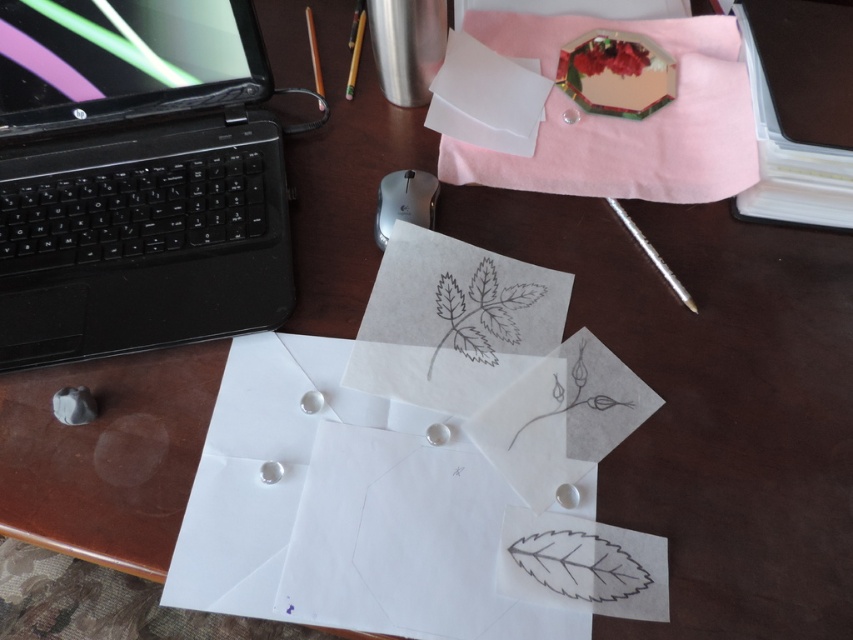
Is metallic silver button at center-left smaller than metallic gold pencil at upper center?

Yes.

Can you confirm if metallic silver button at center-left is bigger than metallic gold pencil at upper center?

Incorrect, metallic silver button at center-left is not larger than metallic gold pencil at upper center.

Is point (79, 400) less distant than point (350, 74)?

Yes, point (79, 400) is in front of point (350, 74).

The width and height of the screenshot is (853, 640). Find the location of `metallic silver button at center-left`. metallic silver button at center-left is located at coordinates (73, 404).

Is black plastic laptop at left below metallic silver button at center-left?

No.

At what (x,y) coordinates should I click in order to perform the action: click on black plastic laptop at left. Please return your answer as a coordinate pair (x, y). Looking at the image, I should click on (136, 179).

Between point (195, 253) and point (61, 392), which one is positioned behind?

Point (195, 253)

At what (x,y) coordinates should I click in order to perform the action: click on black plastic laptop at left. Please return your answer as a coordinate pair (x, y). This screenshot has height=640, width=853. Looking at the image, I should click on (136, 179).

Does silver plastic mouse at center appear on the right side of metallic silver button at center-left?

Correct, you'll find silver plastic mouse at center to the right of metallic silver button at center-left.

The height and width of the screenshot is (640, 853). I want to click on silver plastic mouse at center, so (x=404, y=202).

You are a GUI agent. You are given a task and a screenshot of the screen. Output one action in this format:
    pyautogui.click(x=<x>, y=<y>)
    Task: Click on the silver plastic mouse at center
    The image size is (853, 640).
    Given the screenshot: What is the action you would take?
    pyautogui.click(x=404, y=202)